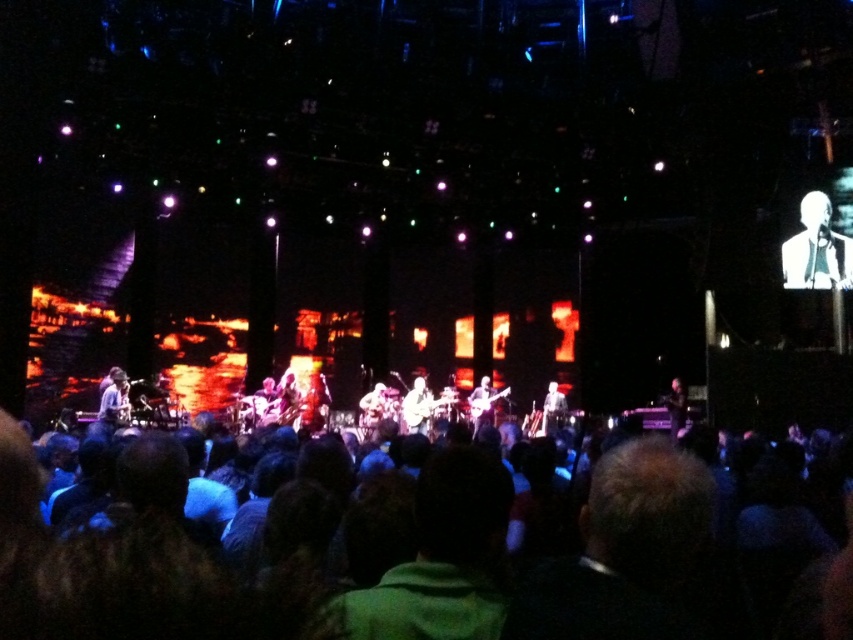
Question: Is dark hair at center wider than white suit at upper right?

Choices:
 (A) yes
 (B) no

Answer: (B)

Question: Which object appears farthest from the camera in this image?

Choices:
 (A) dark hair at center
 (B) white suit at upper right

Answer: (B)

Question: Is dark hair at center below white suit at upper right?

Choices:
 (A) no
 (B) yes

Answer: (B)

Question: Can you confirm if dark hair at center is smaller than white suit at upper right?

Choices:
 (A) yes
 (B) no

Answer: (A)

Question: Which object appears closest to the camera in this image?

Choices:
 (A) white suit at upper right
 (B) dark hair at center

Answer: (B)